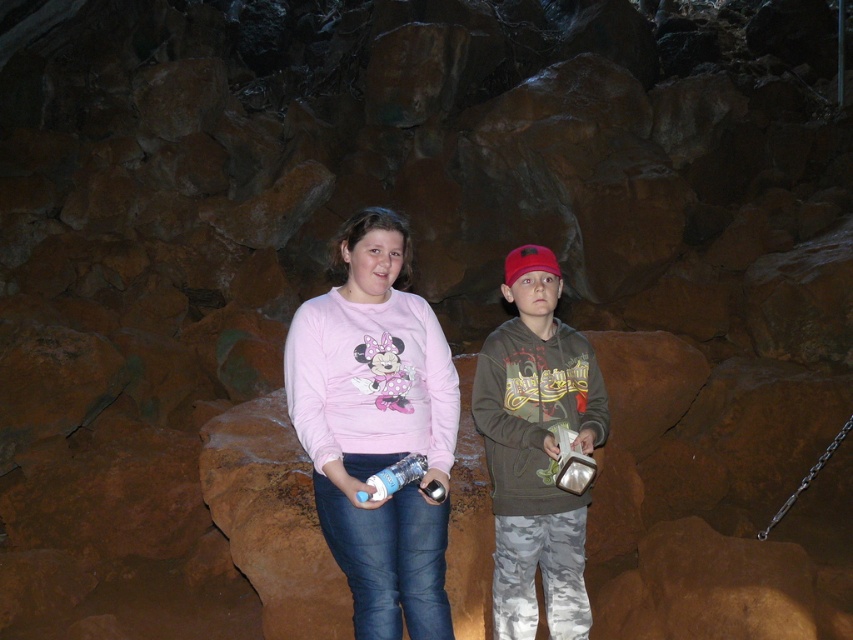
Question: Observing the image, what is the correct spatial positioning of matte pink sweatshirt at center in reference to camouflage pants at center?

Choices:
 (A) above
 (B) below

Answer: (A)

Question: Is matte pink sweatshirt at center below camouflage pants at center?

Choices:
 (A) no
 (B) yes

Answer: (A)

Question: Which of the following is the closest to the observer?

Choices:
 (A) 524,262
 (B) 428,433

Answer: (B)

Question: Does matte pink sweatshirt at center have a larger size compared to camouflage pants at center?

Choices:
 (A) no
 (B) yes

Answer: (B)